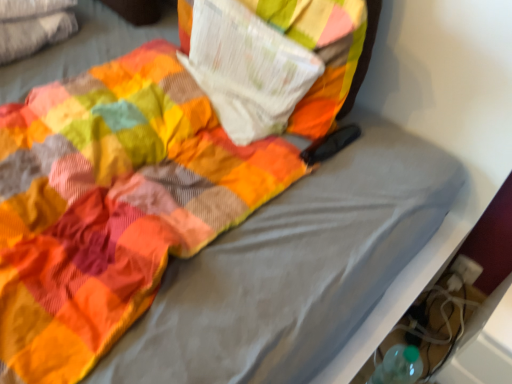
Question: Is leather brown shoe at lower right not inside white paper at upper center?

Choices:
 (A) yes
 (B) no

Answer: (A)

Question: From the image's perspective, is leather brown shoe at lower right on top of white paper at upper center?

Choices:
 (A) yes
 (B) no

Answer: (B)

Question: From the image's perspective, does leather brown shoe at lower right appear lower than white paper at upper center?

Choices:
 (A) yes
 (B) no

Answer: (A)

Question: From a real-world perspective, is leather brown shoe at lower right positioned under white paper at upper center based on gravity?

Choices:
 (A) no
 (B) yes

Answer: (B)

Question: Can you confirm if leather brown shoe at lower right is positioned to the left of white paper at upper center?

Choices:
 (A) no
 (B) yes

Answer: (A)

Question: Can white paper at upper center be found inside leather brown shoe at lower right?

Choices:
 (A) yes
 (B) no

Answer: (B)

Question: Considering the relative sizes of white paper at upper center and leather brown shoe at lower right in the image provided, is white paper at upper center wider than leather brown shoe at lower right?

Choices:
 (A) yes
 (B) no

Answer: (B)

Question: Is white paper at upper center looking in the opposite direction of leather brown shoe at lower right?

Choices:
 (A) no
 (B) yes

Answer: (A)

Question: Is white paper at upper center not close to leather brown shoe at lower right?

Choices:
 (A) no
 (B) yes

Answer: (A)

Question: Is white paper at upper center smaller than leather brown shoe at lower right?

Choices:
 (A) no
 (B) yes

Answer: (B)

Question: Can you confirm if white paper at upper center is bigger than leather brown shoe at lower right?

Choices:
 (A) yes
 (B) no

Answer: (B)

Question: Would you say white paper at upper center is outside leather brown shoe at lower right?

Choices:
 (A) no
 (B) yes

Answer: (B)

Question: In terms of height, does leather brown shoe at lower right look taller or shorter compared to white paper at upper center?

Choices:
 (A) tall
 (B) short

Answer: (A)